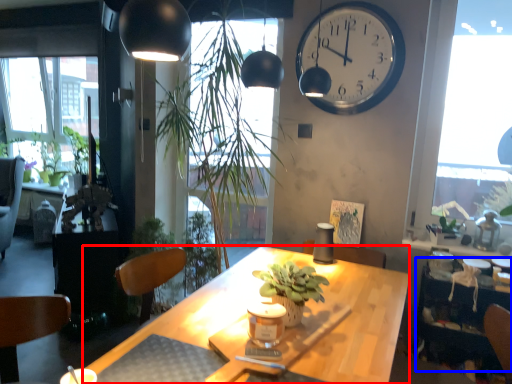
Question: Which of the following is the closest to the observer, desk (highlighted by a red box) or table (highlighted by a blue box)?

Choices:
 (A) desk
 (B) table

Answer: (A)